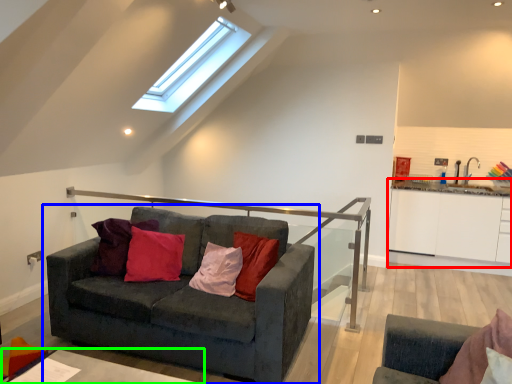
Question: Which object is the closest to the cabinetry (highlighted by a red box)? Choose among these: studio couch (highlighted by a blue box) or table (highlighted by a green box).

Choices:
 (A) studio couch
 (B) table

Answer: (A)